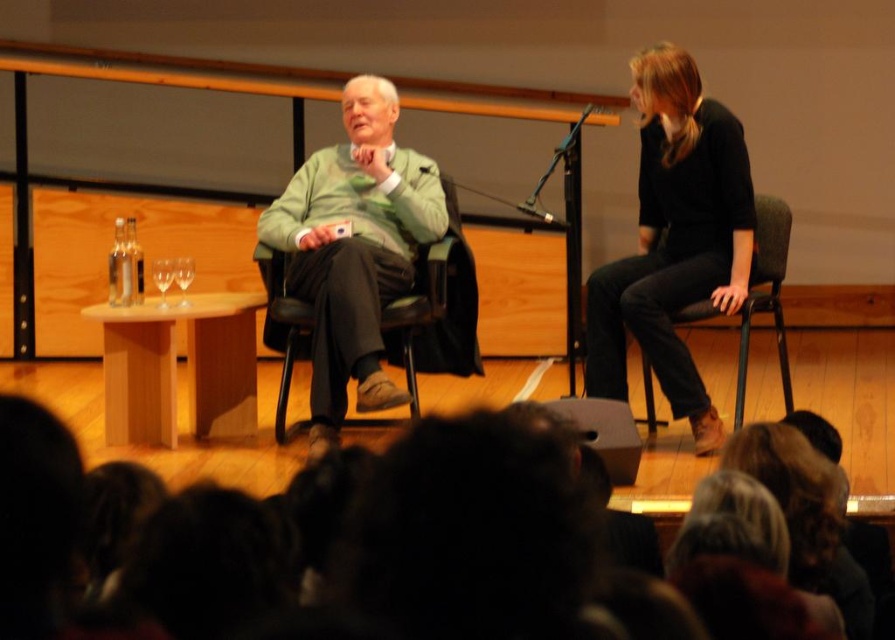
Is point (348, 156) positioned after point (186, 280)?

Yes, point (348, 156) is behind point (186, 280).

Is green fabric jacket at center behind clear glass wine glass at center?

No, green fabric jacket at center is closer to the viewer.

Identify the location of green fabric jacket at center. The width and height of the screenshot is (895, 640). (354, 250).

Which of these two, clear glass wine glass at center or black matte microphone at upper center, stands taller?

clear glass wine glass at center

Is clear glass wine glass at center bigger than black matte microphone at upper center?

Correct, clear glass wine glass at center is larger in size than black matte microphone at upper center.

Is point (180, 280) closer to viewer compared to point (430, 168)?

Yes, it is.

At what (x,y) coordinates should I click in order to perform the action: click on clear glass wine glass at center. Please return your answer as a coordinate pair (x, y). Looking at the image, I should click on click(x=183, y=276).

Locate an element on the screen. The width and height of the screenshot is (895, 640). black matte dress at right is located at coordinates (674, 240).

Is point (655, 272) in front of point (743, 385)?

No, (655, 272) is further to viewer.

Identify the location of black matte dress at right. (674, 240).